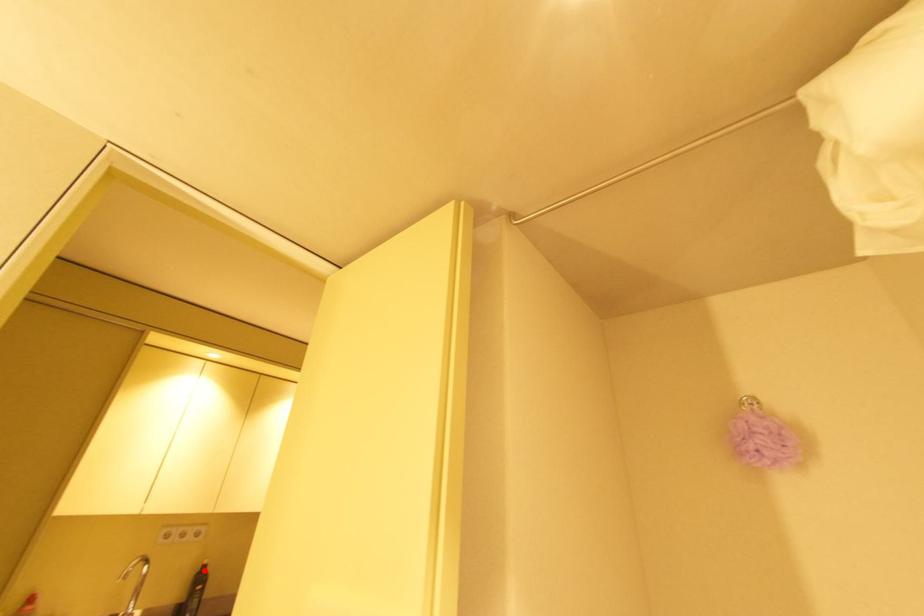
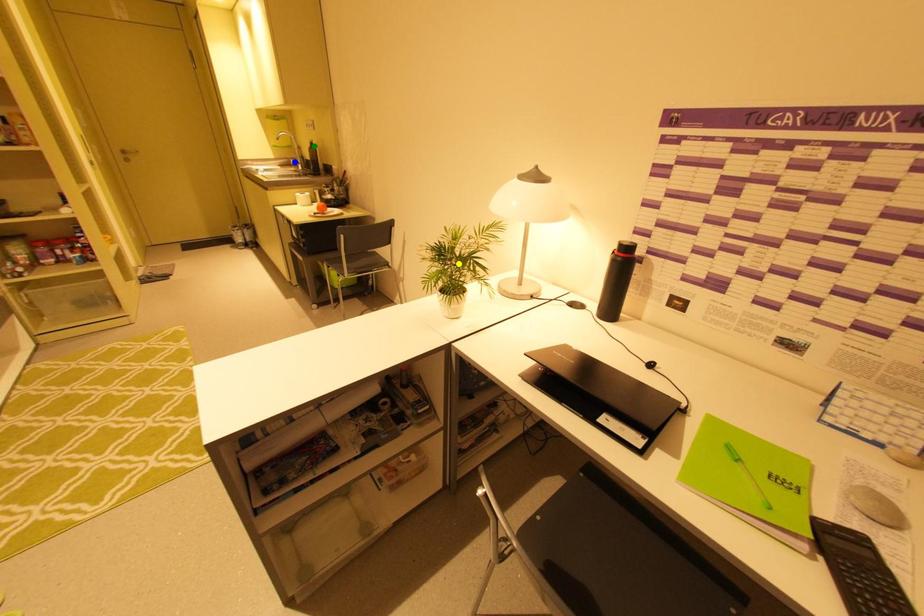
Question: I am providing you with two images of the same scene from different viewpoints. A red point is marked on the first image. You are given multiple points on the second image. Which point in image 2 is actually the same real-world point as the red point in image 1?

Choices:
 (A) green point
 (B) yellow point
 (C) blue point

Answer: (A)